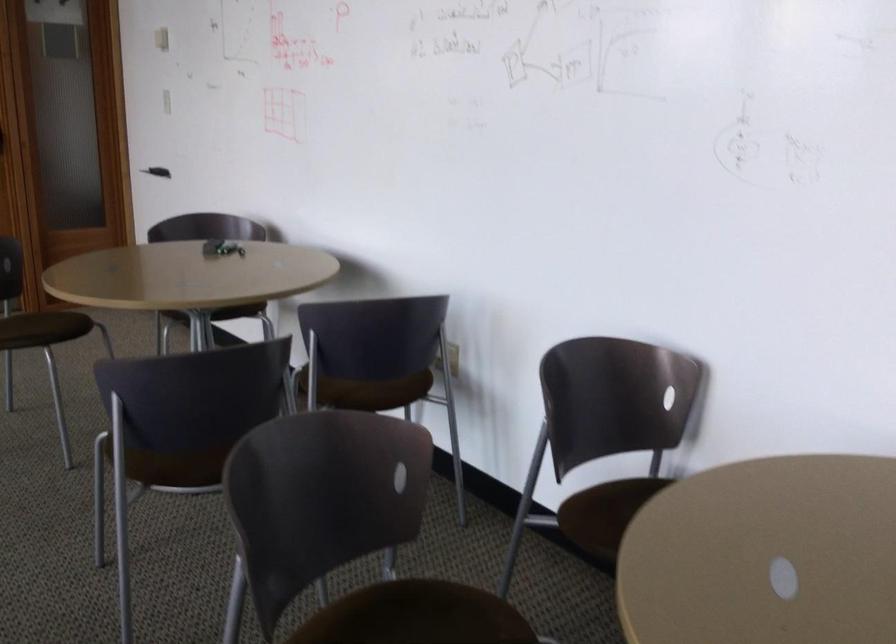
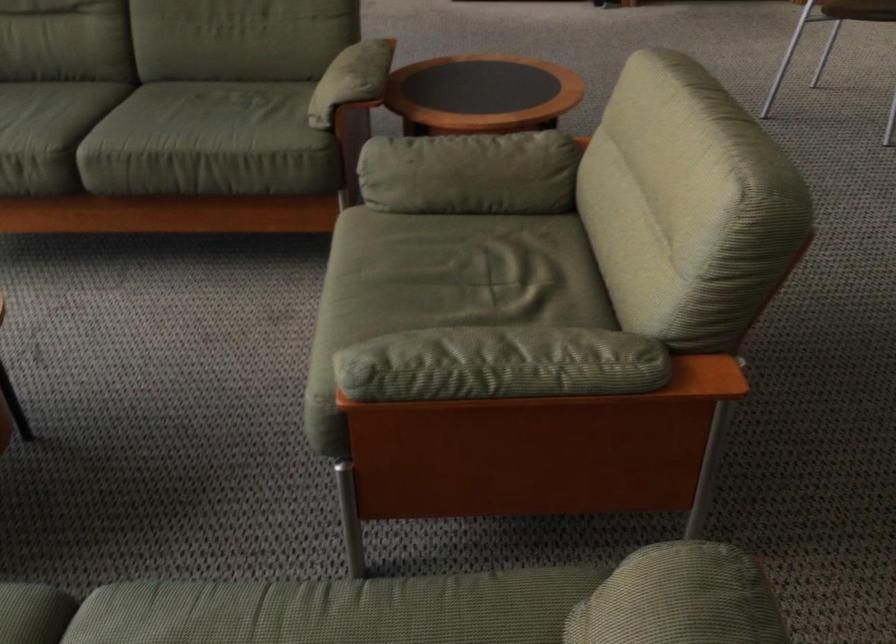
The images are taken continuously from a first-person perspective. In which direction is your viewpoint rotating?

The rotation direction of the camera is left-down.